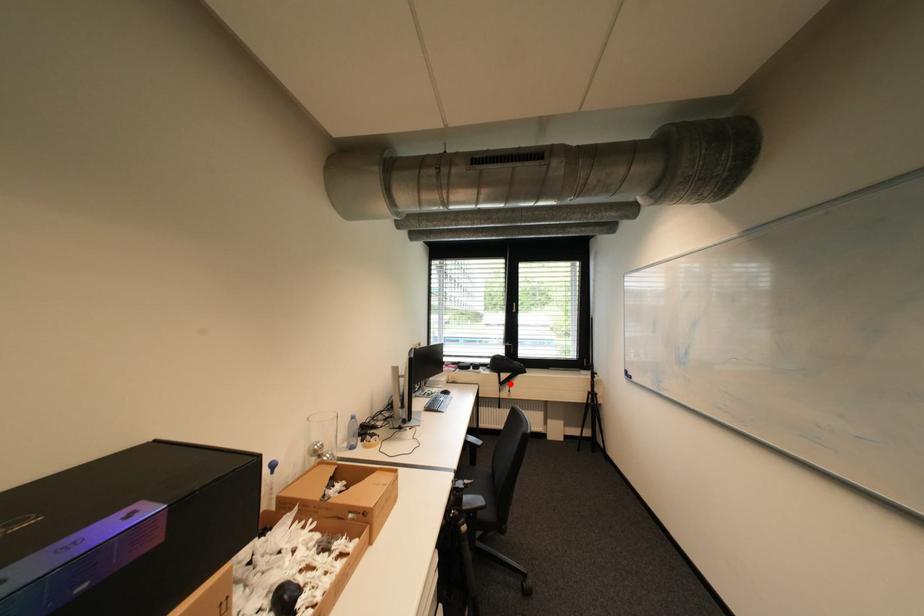
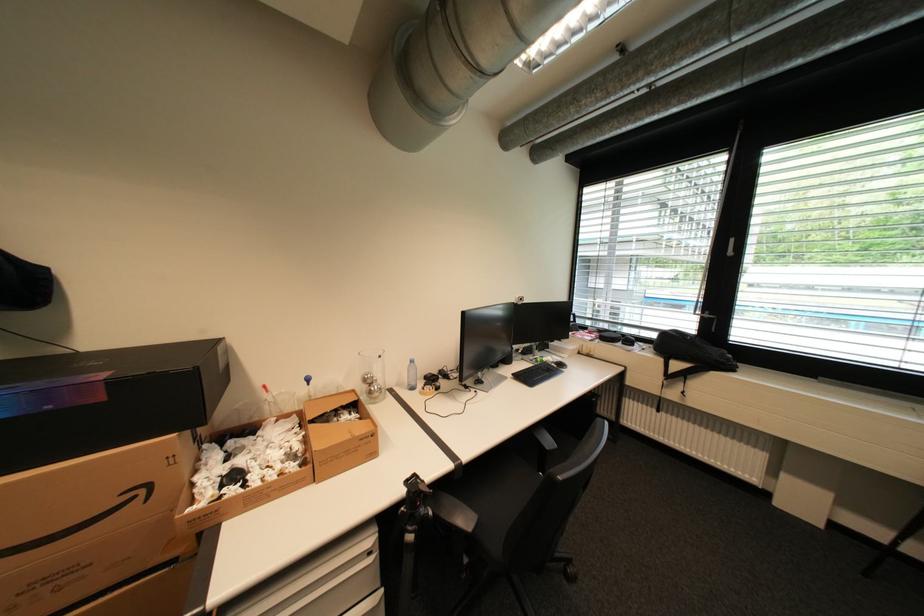
Question: A red point is marked in image1. In image2, is the corresponding 3D point closer to the camera or farther? Reply with the corresponding letter.

Choices:
 (A) The corresponding 3D point is closer.
 (B) The corresponding 3D point is farther.

Answer: (A)